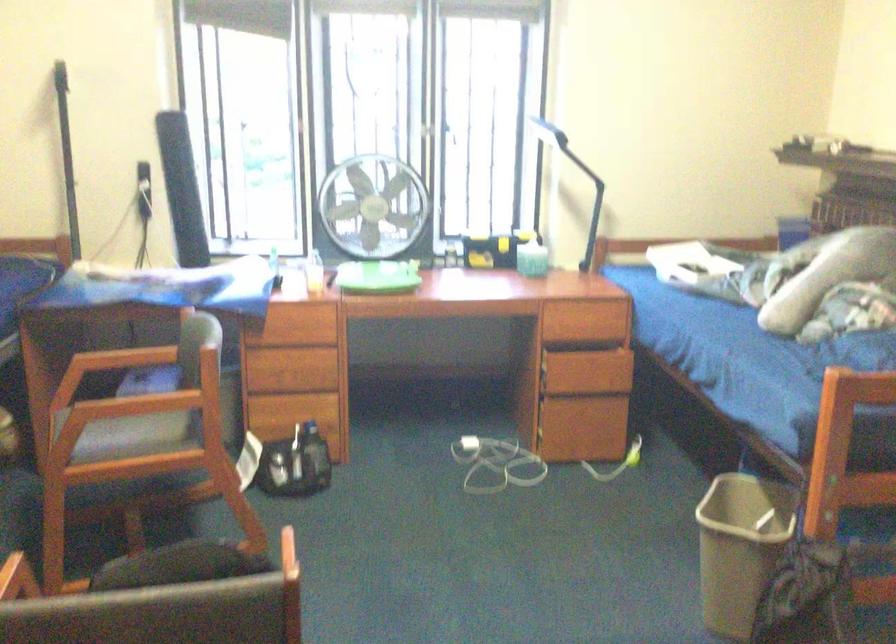
The image size is (896, 644). In order to click on black desk lamp in this screenshot , I will do `click(573, 178)`.